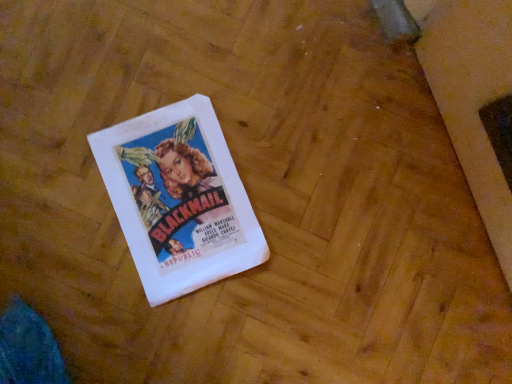
Image resolution: width=512 pixels, height=384 pixels. What do you see at coordinates (178, 199) in the screenshot? I see `white paper poster at center` at bounding box center [178, 199].

The height and width of the screenshot is (384, 512). I want to click on white paper poster at center, so click(178, 199).

Identify the location of white paper poster at center. (178, 199).